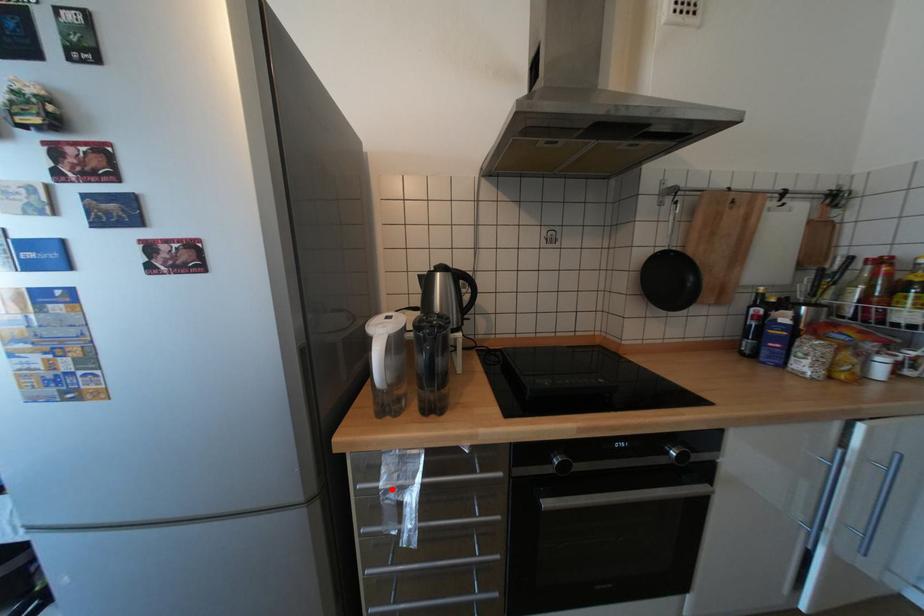
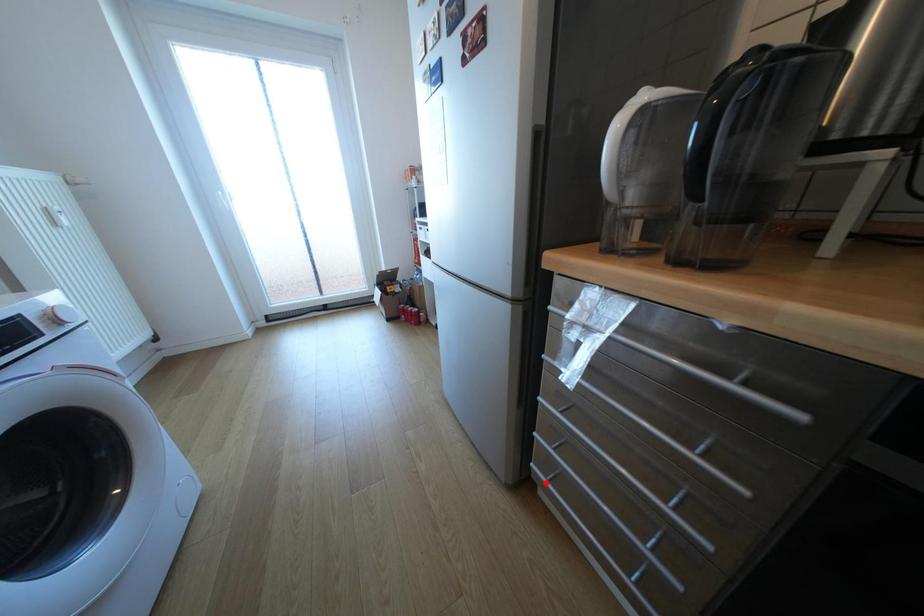
I am providing you with two images of the same scene from different viewpoints. A red point is marked on the first image and another point is marked on the second image. Is the red point in image1 aligned with the point shown in image2?

No